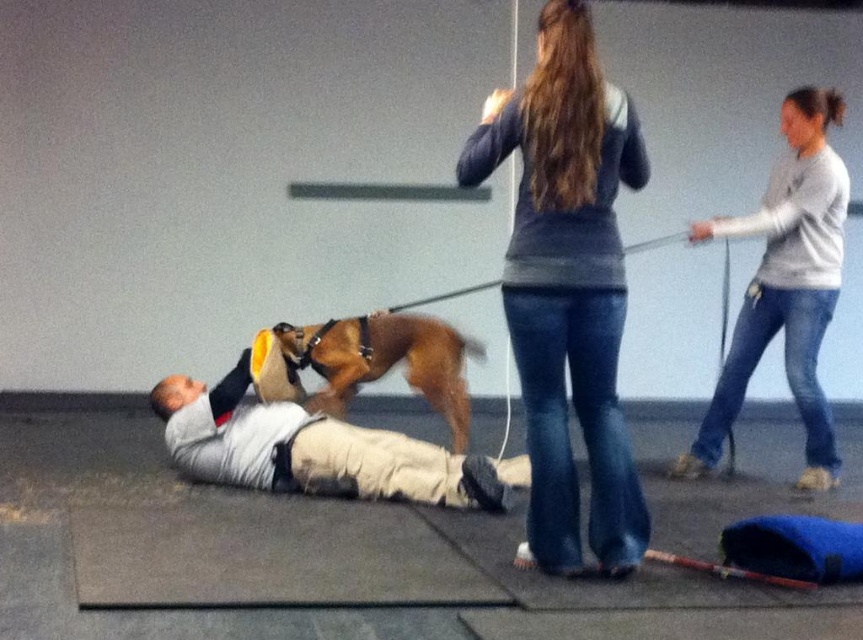
Question: Which point is closer to the camera taking this photo?

Choices:
 (A) (826, 113)
 (B) (597, 369)
 (C) (320, 403)
 (D) (184, 419)

Answer: (B)

Question: Does light gray fabric shirt at center lie behind brown leather dog at center?

Choices:
 (A) no
 (B) yes

Answer: (A)

Question: Does gray sweater at center appear over brown leather dog at center?

Choices:
 (A) yes
 (B) no

Answer: (A)

Question: Does gray sweater at center have a smaller size compared to light gray fabric shirt at center?

Choices:
 (A) no
 (B) yes

Answer: (A)

Question: Which object is closer to the camera taking this photo?

Choices:
 (A) gray cotton shirt at upper right
 (B) brown leather dog at center

Answer: (A)

Question: Based on their relative distances, which object is nearer to the gray sweater at center?

Choices:
 (A) gray cotton shirt at upper right
 (B) brown leather dog at center
 (C) light gray fabric shirt at center

Answer: (C)